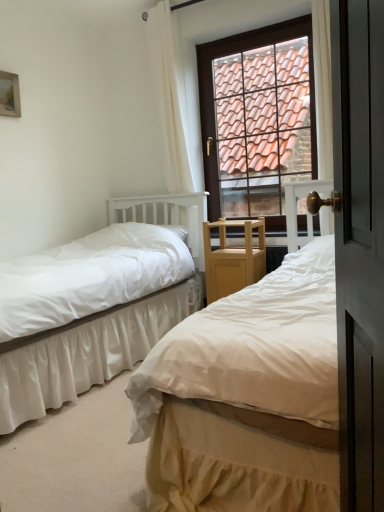
Find the location of a particular element. The height and width of the screenshot is (512, 384). white satin bed at center, which is the first bed from left to right is located at coordinates (100, 304).

Image resolution: width=384 pixels, height=512 pixels. Describe the element at coordinates (257, 118) in the screenshot. I see `brown tile roof at upper center` at that location.

What do you see at coordinates (9, 95) in the screenshot? This screenshot has height=512, width=384. I see `wooden picture frame at upper left` at bounding box center [9, 95].

What do you see at coordinates (170, 96) in the screenshot? This screenshot has width=384, height=512. I see `white sheer curtain at upper center` at bounding box center [170, 96].

What is the approximate height of white cotton bed at center, arranged as the 1th bed when viewed from the right?

white cotton bed at center, arranged as the 1th bed when viewed from the right, is 3.51 feet tall.

At what (x,y) coordinates should I click in order to perform the action: click on white satin bed at center, which is the first bed from left to right. Please return your answer as a coordinate pair (x, y). Looking at the image, I should click on click(x=100, y=304).

From a real-world perspective, does white sheer curtain at upper center sit lower than white cotton bed at center, which ranks as the 2th bed in left-to-right order?

No, from a real-world perspective, white sheer curtain at upper center is not below white cotton bed at center, which ranks as the 2th bed in left-to-right order.

Could you measure the distance between white sheer curtain at upper center and white cotton bed at center, which ranks as the 2th bed in left-to-right order?

A distance of 7.40 feet exists between white sheer curtain at upper center and white cotton bed at center, which ranks as the 2th bed in left-to-right order.

In the scene shown: From the image's perspective, which is below, white sheer curtain at upper center or white cotton bed at center, arranged as the 1th bed when viewed from the right?

white cotton bed at center, arranged as the 1th bed when viewed from the right, is shown below in the image.

Is white sheer curtain at upper center in contact with white cotton bed at center, arranged as the 1th bed when viewed from the right?

No, white sheer curtain at upper center is not in contact with white cotton bed at center, arranged as the 1th bed when viewed from the right.

Is white sheer curtain at upper center positioned far away from wooden picture frame at upper left?

Yes.

Is white sheer curtain at upper center wider than wooden picture frame at upper left?

Yes, white sheer curtain at upper center is wider than wooden picture frame at upper left.

Where is `picture frame that is in front of the white sheer curtain at upper center`? picture frame that is in front of the white sheer curtain at upper center is located at coordinates pyautogui.click(x=9, y=95).

Is white sheer curtain at upper center positioned in front of white satin bed at center, which is the first bed from left to right?

No, the depth of white sheer curtain at upper center is greater than that of white satin bed at center, which is the first bed from left to right.

Between white sheer curtain at upper center and white satin bed at center, which is counted as the second bed, starting from the right, which one appears on the right side from the viewer's perspective?

Positioned to the right is white sheer curtain at upper center.

The height and width of the screenshot is (512, 384). I want to click on bed that is the 2nd one below the white sheer curtain at upper center (from a real-world perspective), so click(x=100, y=304).

Based on the photo, considering the positions of objects white satin bed at center, which is counted as the second bed, starting from the right, and white cotton bed at center, arranged as the 1th bed when viewed from the right, in the image provided, who is more to the left, white satin bed at center, which is counted as the second bed, starting from the right, or white cotton bed at center, arranged as the 1th bed when viewed from the right,?

white satin bed at center, which is counted as the second bed, starting from the right, is more to the left.

Is white satin bed at center, which is counted as the second bed, starting from the right, next to white cotton bed at center, arranged as the 1th bed when viewed from the right?

No, white satin bed at center, which is counted as the second bed, starting from the right, is not touching white cotton bed at center, arranged as the 1th bed when viewed from the right.

Who is shorter, white satin bed at center, which is the first bed from left to right, or white cotton bed at center, which ranks as the 2th bed in left-to-right order?

Standing shorter between the two is white satin bed at center, which is the first bed from left to right.

Is white cotton bed at center, which ranks as the 2th bed in left-to-right order, looking in the opposite direction of matte white screen door at right?

No, white cotton bed at center, which ranks as the 2th bed in left-to-right order, is not facing away from matte white screen door at right.

From the image's perspective, who appears lower, white cotton bed at center, arranged as the 1th bed when viewed from the right, or matte white screen door at right?

white cotton bed at center, arranged as the 1th bed when viewed from the right.

Between white cotton bed at center, which ranks as the 2th bed in left-to-right order, and matte white screen door at right, which one has larger width?

white cotton bed at center, which ranks as the 2th bed in left-to-right order, is wider.

Considering the sizes of objects brown tile roof at upper center and matte white screen door at right in the image provided, who is shorter, brown tile roof at upper center or matte white screen door at right?

With less height is matte white screen door at right.

From the image's perspective, which one is positioned higher, brown tile roof at upper center or matte white screen door at right?

brown tile roof at upper center is shown above in the image.

Could you tell me if brown tile roof at upper center is facing matte white screen door at right?

Yes.

Between white satin bed at center, which is the first bed from left to right, and white sheer curtain at upper center, which one is positioned in front?

Positioned in front is white satin bed at center, which is the first bed from left to right.

Considering the relative sizes of white satin bed at center, which is the first bed from left to right, and white sheer curtain at upper center in the image provided, is white satin bed at center, which is the first bed from left to right, smaller than white sheer curtain at upper center?

No.

Can white sheer curtain at upper center be found inside white satin bed at center, which is counted as the second bed, starting from the right?

Actually, white sheer curtain at upper center is outside white satin bed at center, which is counted as the second bed, starting from the right.

At what (x,y) coordinates should I click in order to perform the action: click on bed on the right of white sheer curtain at upper center. Please return your answer as a coordinate pair (x, y). Image resolution: width=384 pixels, height=512 pixels. Looking at the image, I should click on (246, 395).

At what (x,y) coordinates should I click in order to perform the action: click on picture frame in front of the white sheer curtain at upper center. Please return your answer as a coordinate pair (x, y). The height and width of the screenshot is (512, 384). Looking at the image, I should click on coord(9,95).

Which object lies further to the anchor point white satin bed at center, which is the first bed from left to right, brown tile roof at upper center or matte white screen door at right?

matte white screen door at right is further to white satin bed at center, which is the first bed from left to right.

Considering their positions, is white cotton bed at center, which ranks as the 2th bed in left-to-right order, positioned further to white satin bed at center, which is counted as the second bed, starting from the right, than wooden picture frame at upper left?

The object further to white satin bed at center, which is counted as the second bed, starting from the right, is wooden picture frame at upper left.

Considering their positions, is white satin bed at center, which is counted as the second bed, starting from the right, positioned closer to wooden picture frame at upper left than white cotton bed at center, arranged as the 1th bed when viewed from the right?

white satin bed at center, which is counted as the second bed, starting from the right.

From the image, which object appears to be farther from white sheer curtain at upper center, white satin bed at center, which is the first bed from left to right, or white cotton bed at center, which ranks as the 2th bed in left-to-right order?

Answer: The object further to white sheer curtain at upper center is white cotton bed at center, which ranks as the 2th bed in left-to-right order.

Looking at the image, which one is located closer to wooden picture frame at upper left, white cotton bed at center, arranged as the 1th bed when viewed from the right, or white satin bed at center, which is the first bed from left to right?

white satin bed at center, which is the first bed from left to right, lies closer to wooden picture frame at upper left than the other object.

Consider the image. From the image, which object appears to be farther from wooden picture frame at upper left, brown tile roof at upper center or white satin bed at center, which is counted as the second bed, starting from the right?

brown tile roof at upper center is positioned further to the anchor wooden picture frame at upper left.

Looking at the image, which one is located further to white sheer curtain at upper center, brown tile roof at upper center or white satin bed at center, which is the first bed from left to right?

The object further to white sheer curtain at upper center is white satin bed at center, which is the first bed from left to right.

When comparing their distances from white sheer curtain at upper center, does white cotton bed at center, which ranks as the 2th bed in left-to-right order, or white satin bed at center, which is the first bed from left to right, seem closer?

white satin bed at center, which is the first bed from left to right, is closer to white sheer curtain at upper center.

Where is `window between white cotton bed at center, which ranks as the 2th bed in left-to-right order, and white sheer curtain at upper center in the front-back direction`? window between white cotton bed at center, which ranks as the 2th bed in left-to-right order, and white sheer curtain at upper center in the front-back direction is located at coordinates (257, 118).

Image resolution: width=384 pixels, height=512 pixels. In order to click on picture frame between white satin bed at center, which is counted as the second bed, starting from the right, and white sheer curtain at upper center in the front-back direction in this screenshot , I will do `click(9, 95)`.

Locate an element on the screen. This screenshot has height=512, width=384. picture frame located between matte white screen door at right and brown tile roof at upper center in the depth direction is located at coordinates (9, 95).

Where is `bed positioned between white cotton bed at center, which ranks as the 2th bed in left-to-right order, and brown tile roof at upper center from near to far`? bed positioned between white cotton bed at center, which ranks as the 2th bed in left-to-right order, and brown tile roof at upper center from near to far is located at coordinates (100, 304).